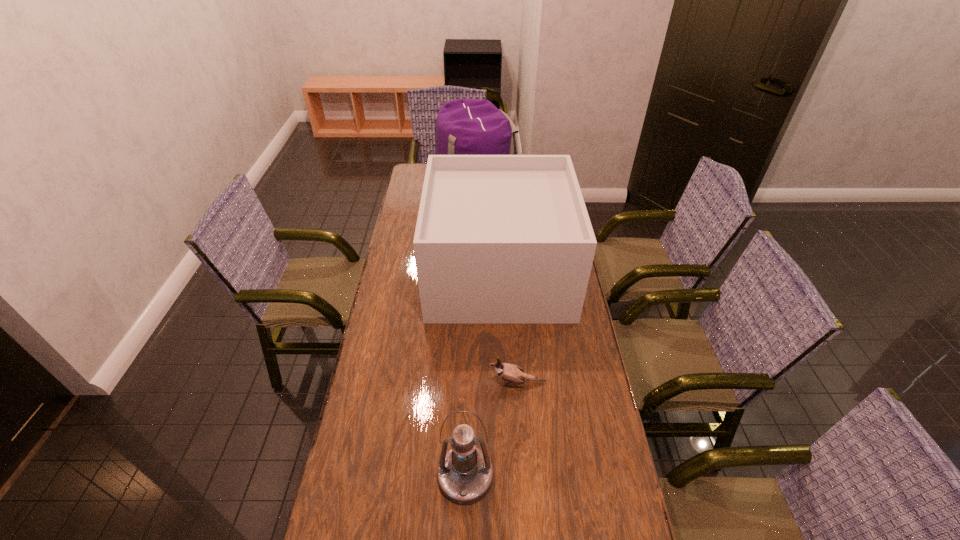
At what (x,y) coordinates should I click in order to perform the action: click on vacant region between the nearest object and the box. Please return your answer as a coordinate pair (x, y). The image size is (960, 540). Looking at the image, I should click on (482, 374).

Locate an element on the screen. This screenshot has height=540, width=960. vacant region between the third nearest object and the third farthest object is located at coordinates (508, 327).

Find the location of a particular element. This screenshot has height=540, width=960. free space between the bird and the nearest object is located at coordinates pyautogui.click(x=492, y=429).

Locate an element on the screen. The width and height of the screenshot is (960, 540). empty space that is in between the box and the nearest object is located at coordinates pos(482,374).

Identify the location of free space between the oil lamp and the second nearest object. The image size is (960, 540). (x=492, y=429).

Point out which object is positioned as the second nearest to the bird. Please provide its 2D coordinates. Your answer should be formatted as a tuple, i.e. [(x, y)], where the tuple contains the x and y coordinates of a point satisfying the conditions above.

[(500, 239)]

Identify which object is the second closest to the shortest object. Please provide its 2D coordinates. Your answer should be formatted as a tuple, i.e. [(x, y)], where the tuple contains the x and y coordinates of a point satisfying the conditions above.

[(500, 239)]